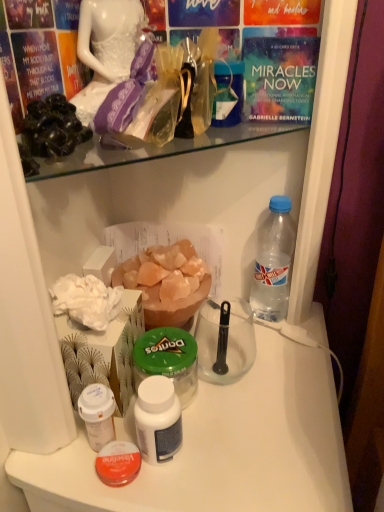
The height and width of the screenshot is (512, 384). Identify the location of vacant area that is in front of pink crystal salt at center. (202, 442).